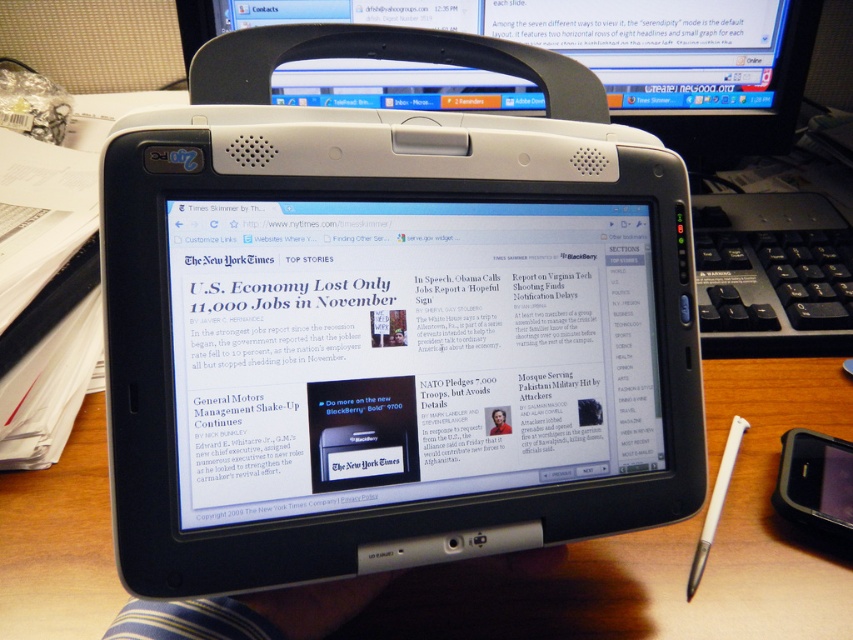
Does black plastic computer monitor at upper center have a larger size compared to white plastic stylus at lower right?

Indeed, black plastic computer monitor at upper center has a larger size compared to white plastic stylus at lower right.

What do you see at coordinates (611, 54) in the screenshot? This screenshot has height=640, width=853. I see `black plastic computer monitor at upper center` at bounding box center [611, 54].

Where is `black plastic computer monitor at upper center`? The image size is (853, 640). black plastic computer monitor at upper center is located at coordinates (611, 54).

Can you confirm if matte black tablet at center is smaller than white plastic stylus at lower right?

Incorrect, matte black tablet at center is not smaller in size than white plastic stylus at lower right.

What do you see at coordinates (405, 352) in the screenshot? The image size is (853, 640). I see `matte black tablet at center` at bounding box center [405, 352].

This screenshot has height=640, width=853. Find the location of `matte black tablet at center`. matte black tablet at center is located at coordinates (405, 352).

Does wooden table at center appear over black plastic computer monitor at upper center?

Incorrect, wooden table at center is not positioned above black plastic computer monitor at upper center.

Image resolution: width=853 pixels, height=640 pixels. Describe the element at coordinates (662, 547) in the screenshot. I see `wooden table at center` at that location.

What are the coordinates of `wooden table at center` in the screenshot? It's located at (662, 547).

Identify the location of wooden table at center. Image resolution: width=853 pixels, height=640 pixels. (662, 547).